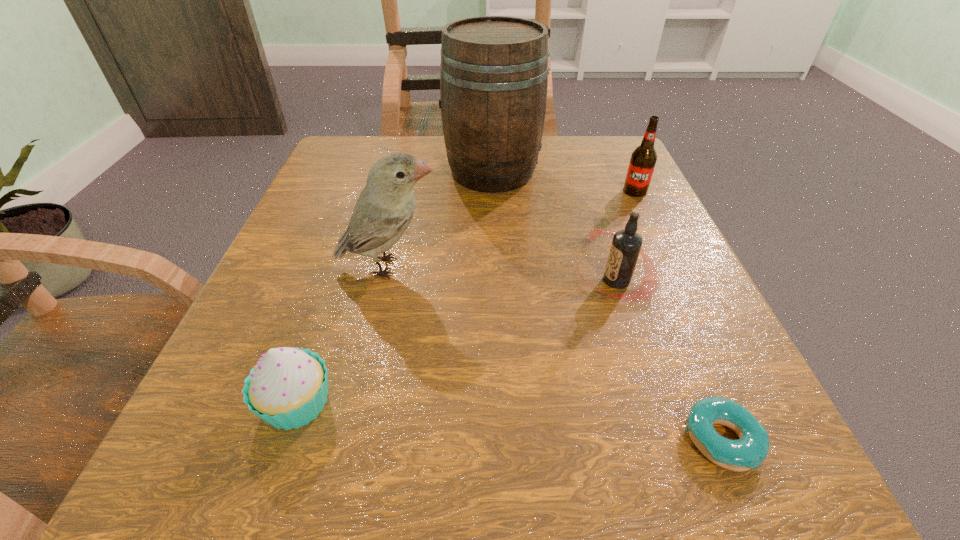
Where is `free space located at the face of the second tallest object`? Image resolution: width=960 pixels, height=540 pixels. free space located at the face of the second tallest object is located at coordinates (516, 267).

You are a GUI agent. You are given a task and a screenshot of the screen. Output one action in this format:
    pyautogui.click(x=<x>, y=<y>)
    Task: Click on the vacant space located on the front of the right root beer
    
    Given the screenshot: What is the action you would take?
    [700, 328]

Image resolution: width=960 pixels, height=540 pixels. I want to click on free space located 0.310m on the label of the nearer root beer, so click(379, 281).

In order to click on vacant region located 0.250m on the label of the nearer root beer in this screenshot , I will do pos(418,281).

Where is `free space located 0.270m on the label of the nearer root beer`? The image size is (960, 540). free space located 0.270m on the label of the nearer root beer is located at coordinates (405, 281).

Locate an element on the screen. Image resolution: width=960 pixels, height=540 pixels. blank space located on the back of the second shortest object is located at coordinates [337, 284].

Identify the location of blank space located 0.050m on the back of the shortest object. This screenshot has width=960, height=540. (692, 372).

Identify the location of cider that is at the far edge. Image resolution: width=960 pixels, height=540 pixels. (494, 70).

Find the location of a particular element. root beer that is at the far edge is located at coordinates (643, 159).

The width and height of the screenshot is (960, 540). I want to click on cupcake that is at the near edge, so click(x=287, y=388).